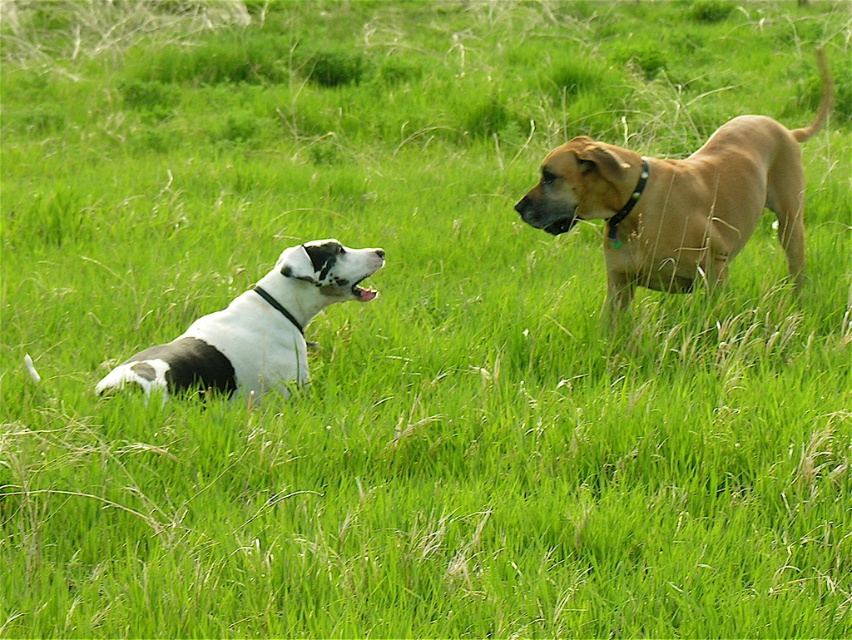
Looking at this image, is golden tan fur at right thinner than black leather neckband at upper right?

Incorrect, golden tan fur at right's width is not less than black leather neckband at upper right's.

Is point (692, 209) closer to viewer compared to point (636, 189)?

That is False.

Is point (688, 157) closer to viewer compared to point (626, 204)?

That is False.

Identify the location of golden tan fur at right. This screenshot has width=852, height=640. (681, 202).

Does golden tan fur at right have a lesser height compared to white-black fur dog at left?

In fact, golden tan fur at right may be taller than white-black fur dog at left.

Does golden tan fur at right have a greater width compared to white-black fur dog at left?

Correct, the width of golden tan fur at right exceeds that of white-black fur dog at left.

The height and width of the screenshot is (640, 852). I want to click on golden tan fur at right, so click(x=681, y=202).

Locate an element on the screen. golden tan fur at right is located at coordinates (681, 202).

Which of these two, white-black fur dog at left or black leather neckband at upper right, stands shorter?

Standing shorter between the two is black leather neckband at upper right.

Which is in front, point (300, 285) or point (607, 225)?

Point (300, 285)

Measure the distance between point (308, 248) and camera.

4.90 meters

Where is `white-black fur dog at left`? white-black fur dog at left is located at coordinates (254, 326).